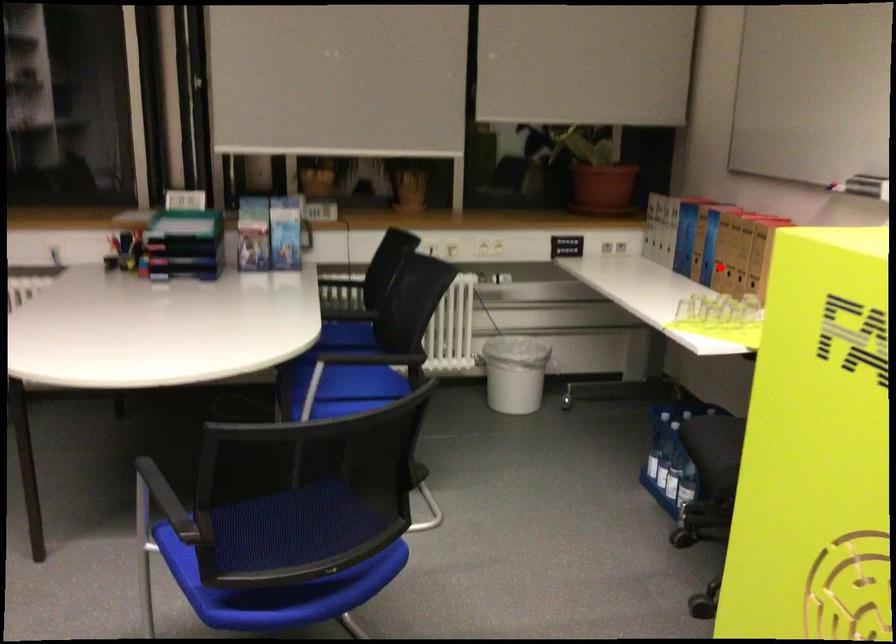
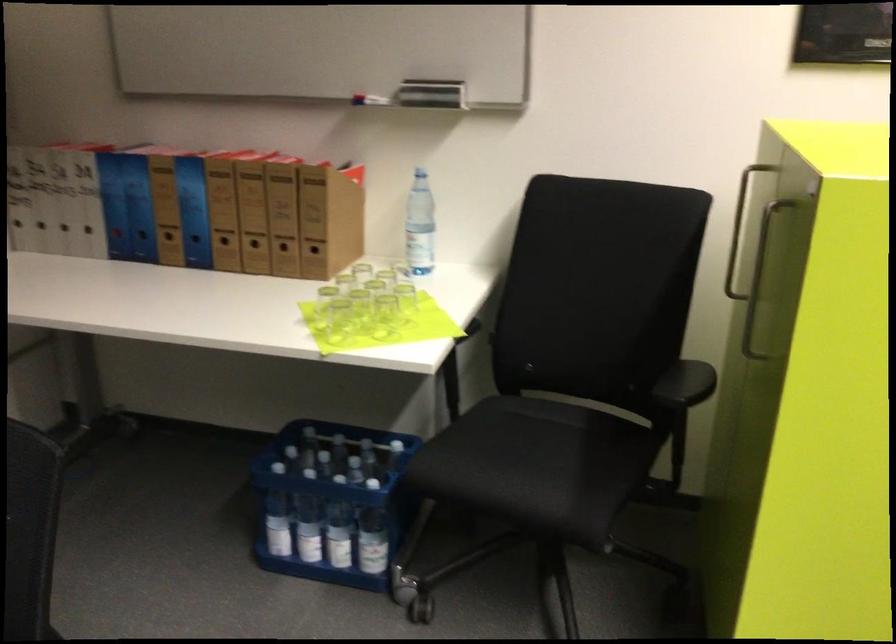
Question: I am providing you with two images of the same scene from different viewpoints. Given a red point in image1, look at the same physical point in image2. Is it:

Choices:
 (A) Closer to the viewpoint
 (B) Farther from the viewpoint

Answer: (A)